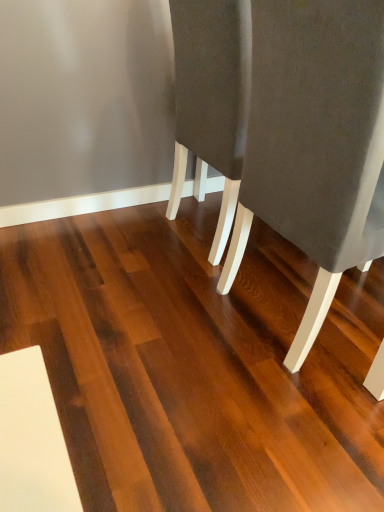
You are a GUI agent. You are given a task and a screenshot of the screen. Output one action in this format:
    pyautogui.click(x=<x>, y=<y>)
    Task: Click on the dark brown wood flooring at center
    
    Given the screenshot: What is the action you would take?
    pyautogui.click(x=196, y=364)

The image size is (384, 512). Describe the element at coordinates (196, 364) in the screenshot. I see `dark brown wood flooring at center` at that location.

The height and width of the screenshot is (512, 384). Find the location of `suede-like gray chair at right`. suede-like gray chair at right is located at coordinates (315, 143).

Measure the distance between point (361,19) and camera.

Point (361,19) is 73.50 centimeters from camera.

This screenshot has width=384, height=512. What do you see at coordinates (315, 143) in the screenshot?
I see `suede-like gray chair at right` at bounding box center [315, 143].

At what (x,y) coordinates should I click in order to perform the action: click on dark brown wood flooring at center. Please return your answer as a coordinate pair (x, y). Looking at the image, I should click on (196, 364).

Between suede-like gray chair at right and dark brown wood flooring at center, which one appears on the right side from the viewer's perspective?

suede-like gray chair at right.

Is suede-like gray chair at right behind dark brown wood flooring at center?

Yes, it is.

Between point (286, 361) and point (376, 474), which one is positioned behind?

The point (286, 361) is more distant.

From the image's perspective, is suede-like gray chair at right above or below dark brown wood flooring at center?

suede-like gray chair at right is situated higher than dark brown wood flooring at center in the image.

From a real-world perspective, is suede-like gray chair at right beneath dark brown wood flooring at center?

Answer: Incorrect, from a real-world perspective, suede-like gray chair at right is higher than dark brown wood flooring at center.

Between suede-like gray chair at right and dark brown wood flooring at center, which one has smaller width?

With smaller width is suede-like gray chair at right.

Can you confirm if suede-like gray chair at right is shorter than dark brown wood flooring at center?

In fact, suede-like gray chair at right may be taller than dark brown wood flooring at center.

Can you confirm if suede-like gray chair at right is smaller than dark brown wood flooring at center?

Actually, suede-like gray chair at right might be larger than dark brown wood flooring at center.

Is suede-like gray chair at right not inside dark brown wood flooring at center?

suede-like gray chair at right lies outside dark brown wood flooring at center's area.

Is suede-like gray chair at right directly adjacent to dark brown wood flooring at center?

suede-like gray chair at right is not next to dark brown wood flooring at center, and they're not touching.

Is suede-like gray chair at right oriented towards dark brown wood flooring at center?

No, suede-like gray chair at right does not turn towards dark brown wood flooring at center.

How different are the orientations of suede-like gray chair at right and dark brown wood flooring at center in degrees?

They differ by 89.6 degrees in their facing directions.

Find the location of a particular element. chair on the right of the dark brown wood flooring at center is located at coordinates (315, 143).

Looking at this image, considering the positions of objects dark brown wood flooring at center and suede-like gray chair at right in the image provided, who is more to the right, dark brown wood flooring at center or suede-like gray chair at right?

suede-like gray chair at right.

In the image, is dark brown wood flooring at center positioned in front of or behind suede-like gray chair at right?

In the image, dark brown wood flooring at center appears in front of suede-like gray chair at right.

Is point (128, 399) closer to viewer compared to point (335, 0)?

That is False.

From the image's perspective, is dark brown wood flooring at center beneath suede-like gray chair at right?

Yes.

From a real-world perspective, is dark brown wood flooring at center located beneath suede-like gray chair at right?

Yes, from a real-world perspective, dark brown wood flooring at center is beneath suede-like gray chair at right.

Can you confirm if dark brown wood flooring at center is thinner than suede-like gray chair at right?

Incorrect, the width of dark brown wood flooring at center is not less than that of suede-like gray chair at right.

Who is taller, dark brown wood flooring at center or suede-like gray chair at right?

suede-like gray chair at right is taller.

Is dark brown wood flooring at center bigger or smaller than suede-like gray chair at right?

dark brown wood flooring at center is smaller than suede-like gray chair at right.

Is dark brown wood flooring at center situated inside suede-like gray chair at right or outside?

dark brown wood flooring at center is located beyond the bounds of suede-like gray chair at right.

Does dark brown wood flooring at center touch suede-like gray chair at right?

No, dark brown wood flooring at center is not touching suede-like gray chair at right.

Is suede-like gray chair at right at the back of dark brown wood flooring at center?

No, dark brown wood flooring at center is not facing away from suede-like gray chair at right.

This screenshot has width=384, height=512. What are the coordinates of `chair on the right of dark brown wood flooring at center` in the screenshot? It's located at (315, 143).

This screenshot has height=512, width=384. What are the coordinates of `chair above the dark brown wood flooring at center (from the image's perspective)` in the screenshot? It's located at (315, 143).

Identify the location of chair above the dark brown wood flooring at center (from a real-world perspective). (315, 143).